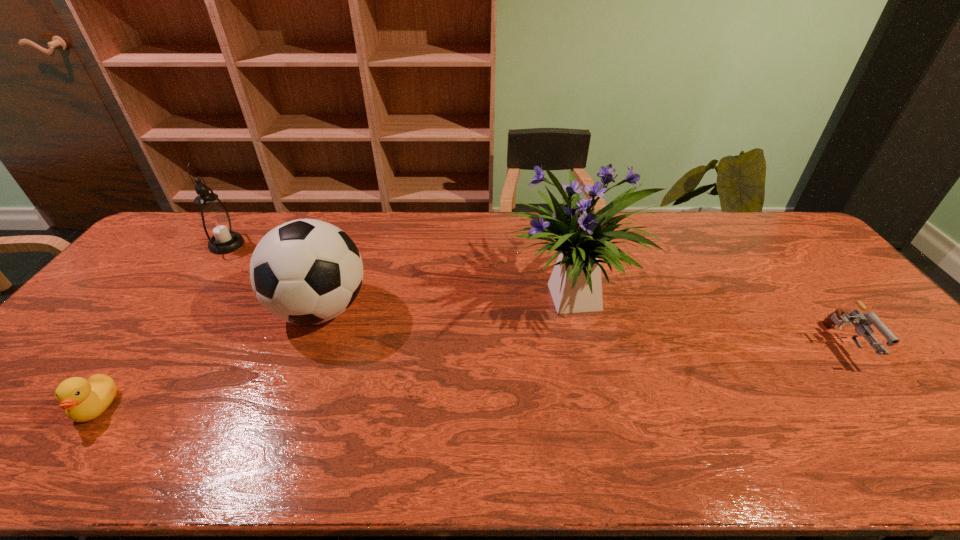
Identify the location of the fourth object from left to right. This screenshot has width=960, height=540. (575, 284).

The width and height of the screenshot is (960, 540). Identify the location of flower arrangement. (575, 284).

Identify the location of oil lamp. (215, 222).

This screenshot has width=960, height=540. Find the location of `soccer ball`. soccer ball is located at coordinates (306, 271).

Where is `gun`? The height and width of the screenshot is (540, 960). gun is located at coordinates (863, 321).

Locate an element on the screen. This screenshot has height=540, width=960. the rightmost object is located at coordinates (863, 321).

Image resolution: width=960 pixels, height=540 pixels. What are the coordinates of `the shortest object` in the screenshot? It's located at (83, 400).

At what (x,y) coordinates should I click in order to perform the action: click on the nearest object. Please return your answer as a coordinate pair (x, y). The image size is (960, 540). Looking at the image, I should click on (83, 400).

The height and width of the screenshot is (540, 960). In order to click on vacant space located on the left of the tallest object in this screenshot , I will do `click(366, 300)`.

Locate an element on the screen. vacant area situated on the right of the farthest object is located at coordinates (261, 245).